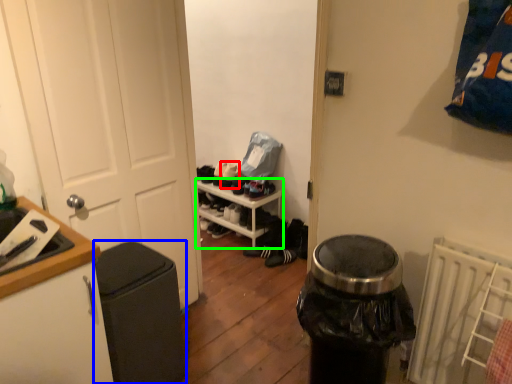
Question: Which is farther away from shoe (highlighted by a red box)? garbage (highlighted by a blue box) or shelf (highlighted by a green box)?

Choices:
 (A) garbage
 (B) shelf

Answer: (A)